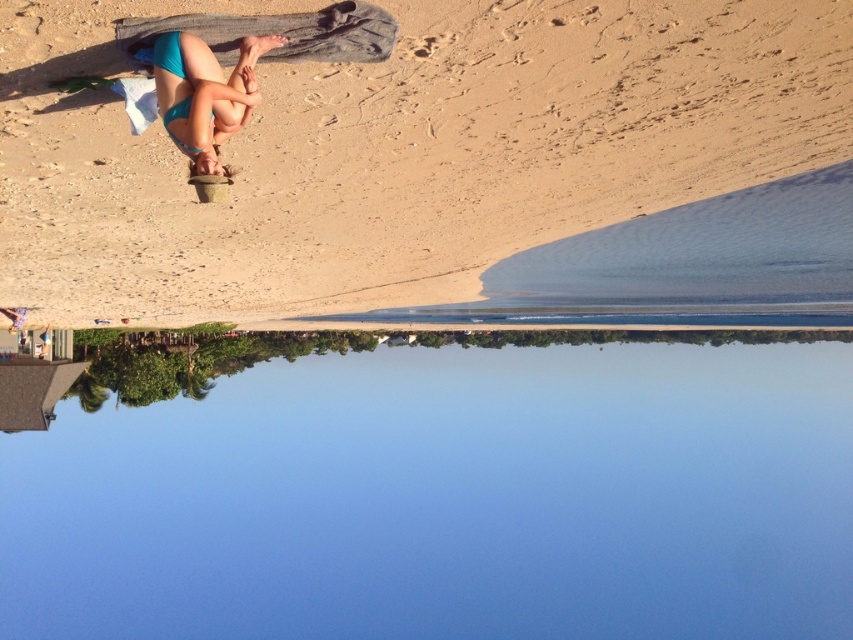
Question: Can you confirm if blue water at center is positioned to the right of teal matte bikini bottom at upper left?

Choices:
 (A) yes
 (B) no

Answer: (A)

Question: Among these points, which one is nearest to the camera?

Choices:
 (A) (222, 116)
 (B) (16, 208)

Answer: (A)

Question: Does blue water at center appear under teal matte bikini bottom at upper left?

Choices:
 (A) yes
 (B) no

Answer: (A)

Question: Can you confirm if beige sand at upper center is thinner than teal matte bikini bottom at upper left?

Choices:
 (A) yes
 (B) no

Answer: (B)

Question: Which of these objects is positioned farthest from the blue water at center?

Choices:
 (A) beige sand at upper center
 (B) teal matte bikini bottom at upper left

Answer: (B)

Question: Which of the following is the closest to the observer?

Choices:
 (A) (509, 580)
 (B) (383, 269)
 (C) (204, 90)

Answer: (C)